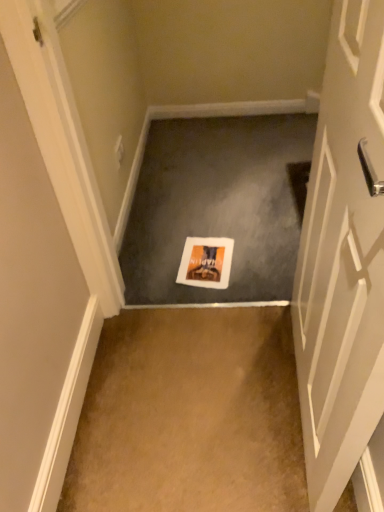
Question: From the image's perspective, does orange matte postcard at center appear lower than white paper at center, which ranks as the 1th concrete in top-to-bottom order?

Choices:
 (A) no
 (B) yes

Answer: (B)

Question: Would you say orange matte postcard at center is outside white paper at center, which appears as the 1th concrete when viewed from the back?

Choices:
 (A) no
 (B) yes

Answer: (B)

Question: Does orange matte postcard at center have a greater height compared to white paper at center, which appears as the 1th concrete when viewed from the back?

Choices:
 (A) no
 (B) yes

Answer: (A)

Question: Does orange matte postcard at center appear on the left side of white paper at center, which ranks as the 1th concrete in top-to-bottom order?

Choices:
 (A) no
 (B) yes

Answer: (B)

Question: Is orange matte postcard at center beside white paper at center, the 2th concrete in the front-to-back sequence?

Choices:
 (A) no
 (B) yes

Answer: (A)

Question: Is white paper at center, which appears as the 1th concrete when viewed from the back, at the back of orange matte postcard at center?

Choices:
 (A) no
 (B) yes

Answer: (B)

Question: From a real-world perspective, is brown carpet at center, which is counted as the 2th concrete, starting from the top, beneath white paper at center, the 2th concrete in the front-to-back sequence?

Choices:
 (A) no
 (B) yes

Answer: (B)

Question: Is brown carpet at center, which is counted as the 2th concrete, starting from the top, oriented towards white paper at center, which appears as the 1th concrete when viewed from the back?

Choices:
 (A) yes
 (B) no

Answer: (A)

Question: Can you confirm if brown carpet at center, positioned as the 2th concrete in back-to-front order, is bigger than white paper at center, which appears as the 1th concrete when viewed from the back?

Choices:
 (A) yes
 (B) no

Answer: (B)

Question: Is brown carpet at center, marked as the first concrete in a bottom-to-top arrangement, looking in the opposite direction of white paper at center, the 2th concrete in the front-to-back sequence?

Choices:
 (A) yes
 (B) no

Answer: (B)

Question: Considering the relative sizes of brown carpet at center, which is counted as the 2th concrete, starting from the top, and white paper at center, the 2th concrete in the front-to-back sequence, in the image provided, is brown carpet at center, which is counted as the 2th concrete, starting from the top, smaller than white paper at center, the 2th concrete in the front-to-back sequence,?

Choices:
 (A) yes
 (B) no

Answer: (A)

Question: Considering the relative sizes of brown carpet at center, which is counted as the first concrete, starting from the front, and white paper at center, the 2th concrete positioned from the bottom, in the image provided, is brown carpet at center, which is counted as the first concrete, starting from the front, shorter than white paper at center, the 2th concrete positioned from the bottom,?

Choices:
 (A) no
 (B) yes

Answer: (A)

Question: Is white glossy door at center right completely or partially outside of orange matte postcard at center?

Choices:
 (A) yes
 (B) no

Answer: (A)